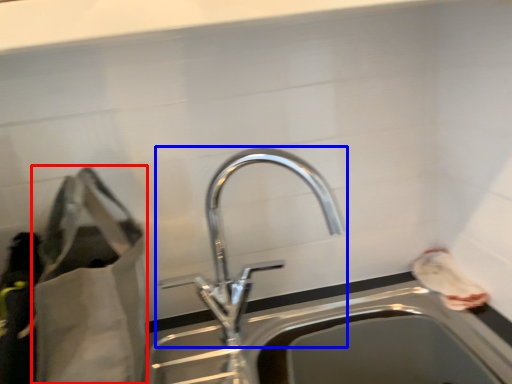
Question: Which object appears farthest to the camera in this image, bag (highlighted by a red box) or tap (highlighted by a blue box)?

Choices:
 (A) bag
 (B) tap

Answer: (B)